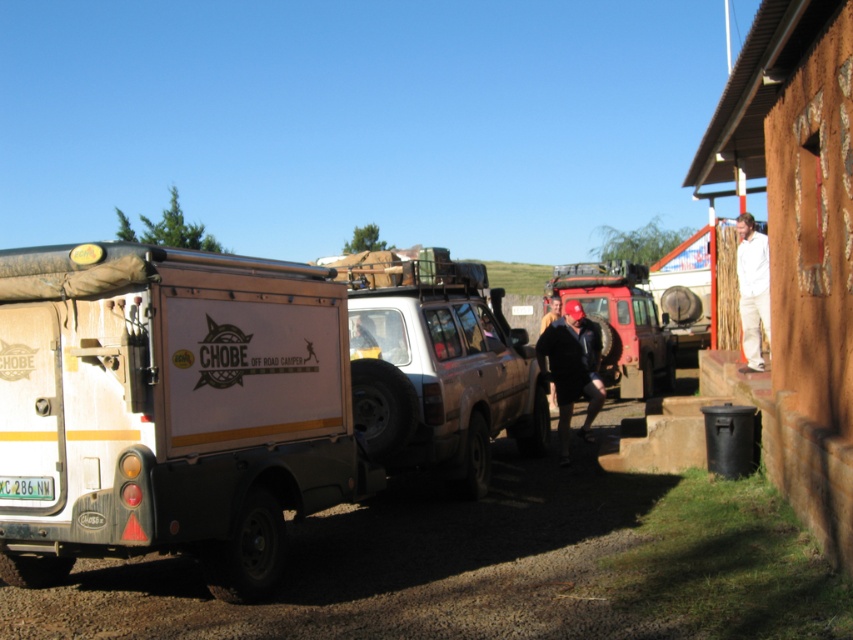
Question: Can you confirm if matte white camper at center is thinner than brown leather jacket at center?

Choices:
 (A) no
 (B) yes

Answer: (A)

Question: Which point is farther to the camera?

Choices:
 (A) matte white camper at center
 (B) matte red jeep at center
 (C) matte beige suv at center
 (D) dark blue jeans at center

Answer: (B)

Question: Which object is the closest to the matte white camper at center?

Choices:
 (A) matte red jeep at center
 (B) white cotton shirt at right
 (C) matte beige suv at center

Answer: (C)

Question: Is matte white camper at center positioned in front of dark blue jeans at center?

Choices:
 (A) no
 (B) yes

Answer: (B)

Question: Which object is closer to the camera taking this photo?

Choices:
 (A) matte white camper at center
 (B) brown leather jacket at center

Answer: (A)

Question: Where is matte white camper at center located in relation to white cotton shirt at right in the image?

Choices:
 (A) below
 (B) above

Answer: (A)